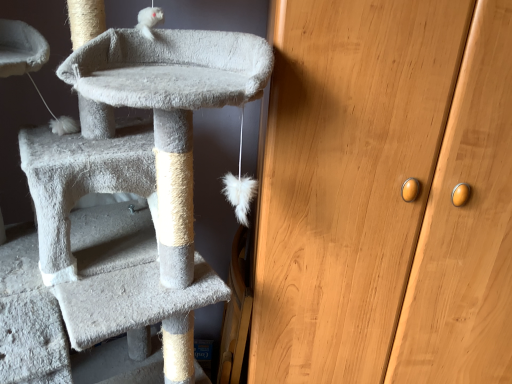
Question: Could you tell me if soft gray carpeted cat tree at left is facing wooden cabinet at right?

Choices:
 (A) yes
 (B) no

Answer: (B)

Question: Considering the relative sizes of soft gray carpeted cat tree at left and wooden cabinet at right in the image provided, is soft gray carpeted cat tree at left taller than wooden cabinet at right?

Choices:
 (A) no
 (B) yes

Answer: (A)

Question: Considering the relative sizes of soft gray carpeted cat tree at left and wooden cabinet at right in the image provided, is soft gray carpeted cat tree at left shorter than wooden cabinet at right?

Choices:
 (A) no
 (B) yes

Answer: (B)

Question: From the image's perspective, would you say soft gray carpeted cat tree at left is shown under wooden cabinet at right?

Choices:
 (A) yes
 (B) no

Answer: (A)

Question: Is soft gray carpeted cat tree at left bigger than wooden cabinet at right?

Choices:
 (A) yes
 (B) no

Answer: (B)

Question: Does soft gray carpeted cat tree at left appear on the left side of wooden cabinet at right?

Choices:
 (A) no
 (B) yes

Answer: (B)

Question: Is soft gray carpeted cat tree at left located within wooden cabinet at right?

Choices:
 (A) no
 (B) yes

Answer: (A)

Question: From the image's perspective, does wooden cabinet at right appear lower than soft gray carpeted cat tree at left?

Choices:
 (A) yes
 (B) no

Answer: (B)

Question: Is wooden cabinet at right placed right next to soft gray carpeted cat tree at left?

Choices:
 (A) no
 (B) yes

Answer: (A)

Question: Considering the relative positions of wooden cabinet at right and soft gray carpeted cat tree at left in the image provided, is wooden cabinet at right in front of soft gray carpeted cat tree at left?

Choices:
 (A) yes
 (B) no

Answer: (B)

Question: Is wooden cabinet at right shorter than soft gray carpeted cat tree at left?

Choices:
 (A) yes
 (B) no

Answer: (B)

Question: Can you confirm if wooden cabinet at right is wider than soft gray carpeted cat tree at left?

Choices:
 (A) no
 (B) yes

Answer: (A)

Question: Is point (496, 261) closer or farther from the camera than point (112, 311)?

Choices:
 (A) farther
 (B) closer

Answer: (A)